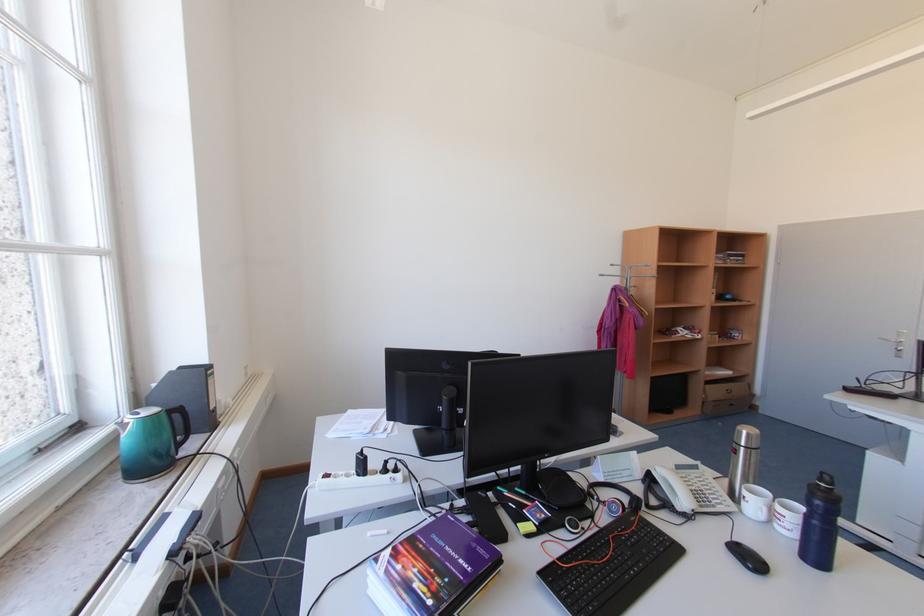
This screenshot has width=924, height=616. Describe the element at coordinates (681, 488) in the screenshot. I see `a telephone handset` at that location.